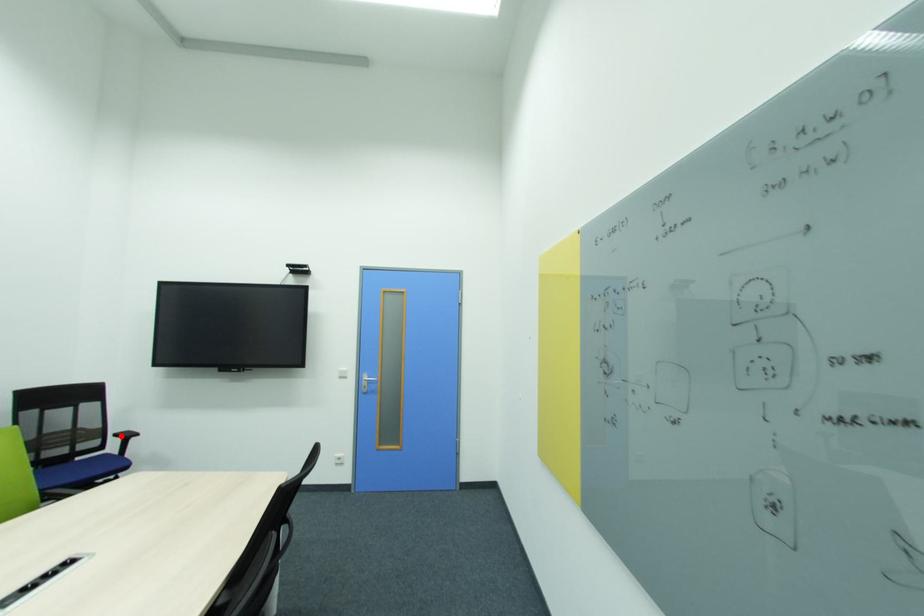
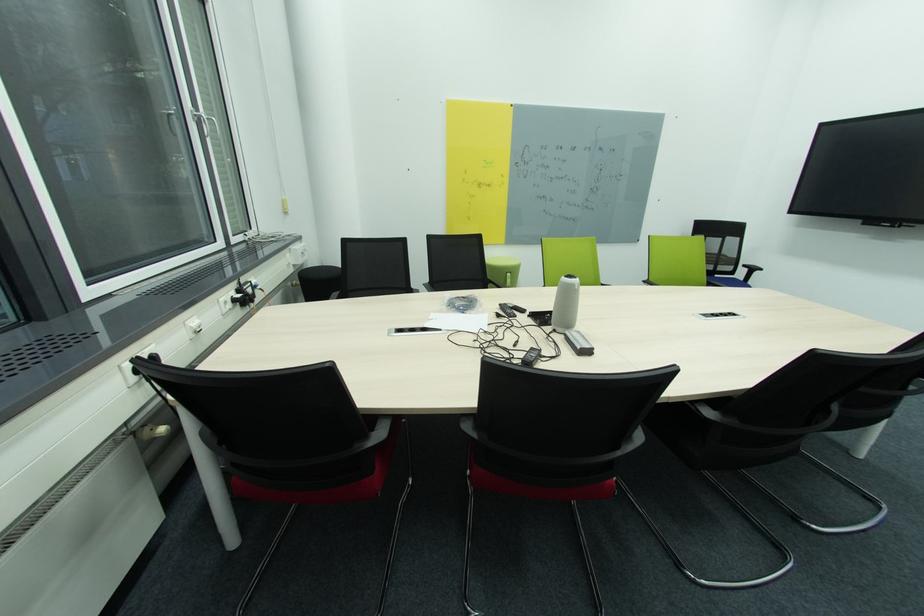
Question: I am providing you with two images of the same scene from different viewpoints. A red point is shown in image1. For the corresponding object point in image2, is it positioned nearer or farther from the camera?

Choices:
 (A) Nearer
 (B) Farther

Answer: (B)